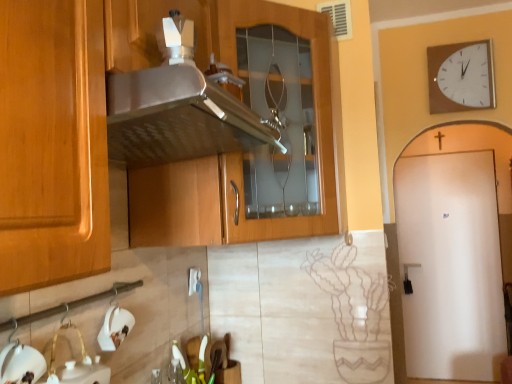
Identify the location of free space above white matte door at right (from a real-world perspective). (441, 155).